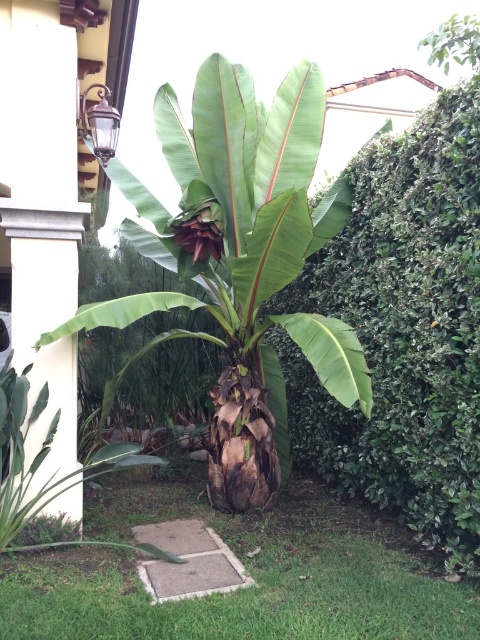
You are a gardener who wants to plant a new flower bed between the green leafy banana tree at center and the green grass at center. Based on their positions, where should you place the flower bed?

The green leafy banana tree at center is positioned over green grass at center, so the flower bed should be placed between the base of the green leafy banana tree at center and the surrounding green grass at center to ensure proper spacing.

You are standing in the garden and want to water both the green leafy bush at center and the green leafy banana tree at center. Which one should you water first if you want to water the one closer to you first?

You should water the green leafy bush at center first because it is in front of the green leafy banana tree at center, making it closer to you.

From the picture: You are standing in the garden and want to walk towards the green grass at center. Which direction should you move relative to the green leafy banana tree at center?

The green grass at center is behind the green leafy banana tree at center, so you should move backward away from the tree to reach the green grass at center.